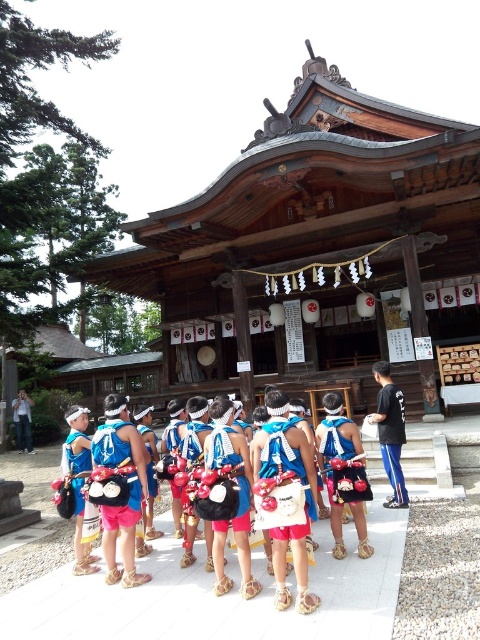
Question: Which object appears farthest from the camera in this image?

Choices:
 (A) blue fabric sash at center
 (B) denim jacket at lower left

Answer: (B)

Question: Which of the following is the closest to the observer?

Choices:
 (A) blue fabric sash at center
 (B) denim jacket at lower left

Answer: (A)

Question: From the image, what is the correct spatial relationship of blue fabric sash at center in relation to denim jacket at lower left?

Choices:
 (A) right
 (B) left

Answer: (A)

Question: Which point is closer to the camera?

Choices:
 (A) (24, 436)
 (B) (393, 461)

Answer: (B)

Question: Is blue fabric sash at center positioned before denim jacket at lower left?

Choices:
 (A) yes
 (B) no

Answer: (A)

Question: Where is blue fabric sash at center located in relation to denim jacket at lower left in the image?

Choices:
 (A) left
 (B) right

Answer: (B)